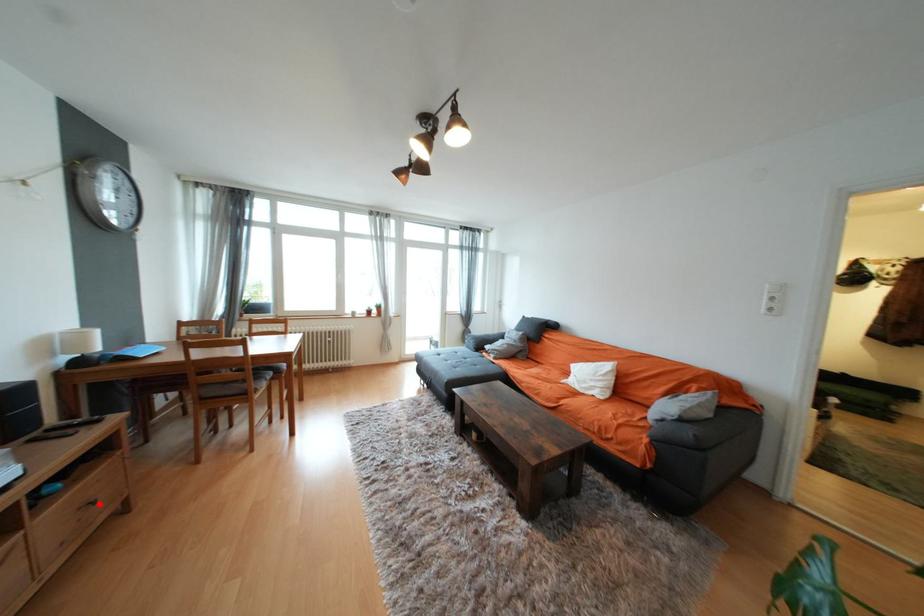
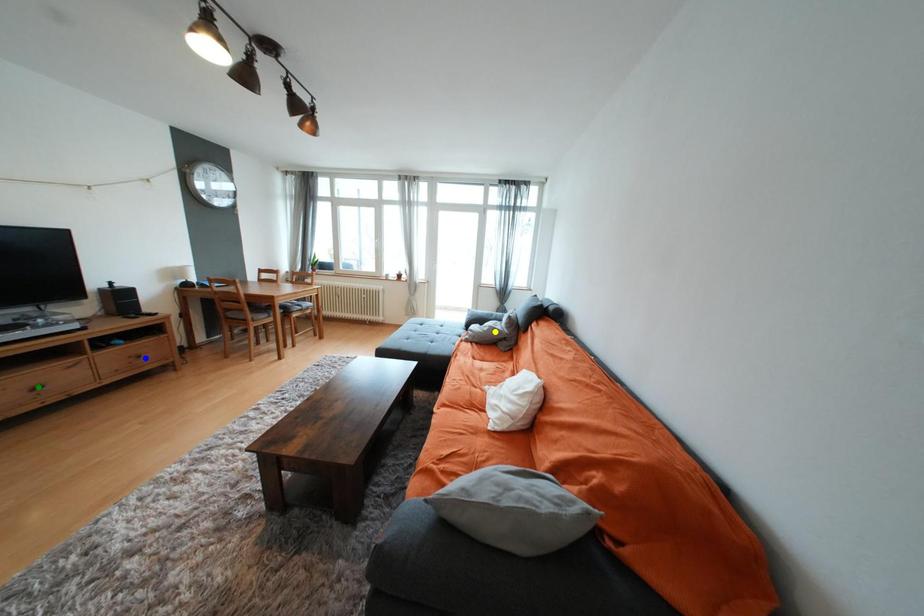
Question: I am providing you with two images of the same scene from different viewpoints. A red point is marked on the first image. You are given multiple points on the second image. Which point in image 2 is actually the same real-world point as the red point in image 1?

Choices:
 (A) blue point
 (B) yellow point
 (C) green point

Answer: (A)